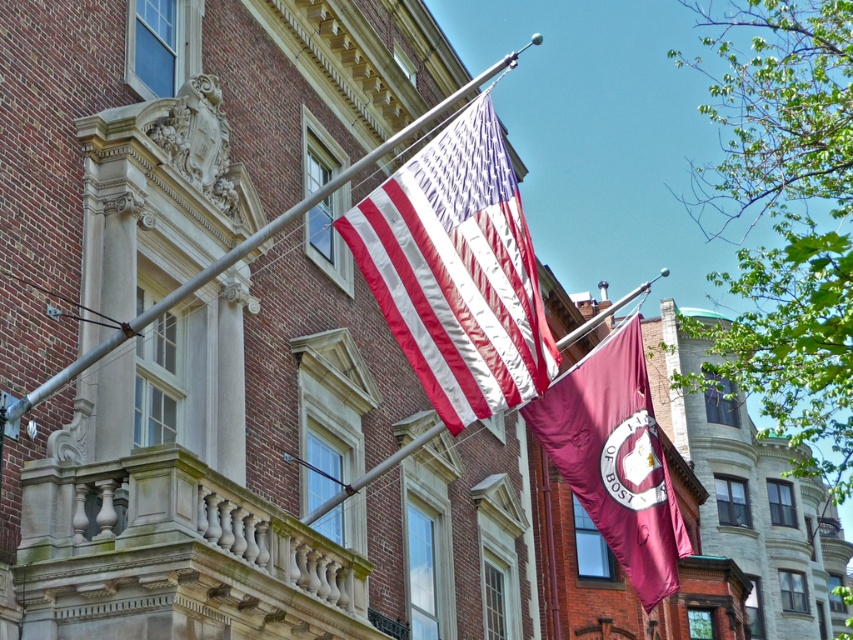
Question: Can you confirm if maroon fabric flag at center is smaller than metallic pole at upper center?

Choices:
 (A) yes
 (B) no

Answer: (A)

Question: Which point is farther from the camera taking this photo?

Choices:
 (A) (610, 401)
 (B) (489, 182)

Answer: (A)

Question: Is matte fabric flag at center bigger than maroon fabric flag at center?

Choices:
 (A) no
 (B) yes

Answer: (A)

Question: Which object is the closest to the maroon fabric flag at center?

Choices:
 (A) matte fabric flag at center
 (B) metallic pole at upper center

Answer: (B)

Question: In this image, where is matte fabric flag at center located relative to metallic pole at upper center?

Choices:
 (A) left
 (B) right

Answer: (A)

Question: Among these points, which one is farthest from the camera?

Choices:
 (A) (415, 337)
 (B) (636, 317)

Answer: (B)